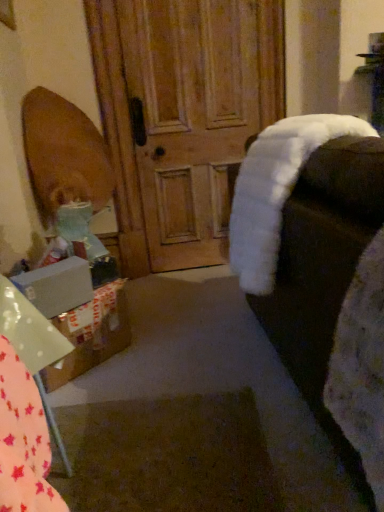
You are a GUI agent. You are given a task and a screenshot of the screen. Output one action in this format:
    pyautogui.click(x=<x>, y=<y>)
    Task: Click on the white fluffy rocking chair at right
    Image resolution: width=384 pixels, height=512 pixels.
    Given the screenshot: What is the action you would take?
    pyautogui.click(x=307, y=242)

Where is `white cardboard box at lower left`? white cardboard box at lower left is located at coordinates (92, 334).

This screenshot has height=512, width=384. Describe the element at coordinates (92, 334) in the screenshot. I see `white cardboard box at lower left` at that location.

This screenshot has height=512, width=384. In order to click on white fluffy rocking chair at right in this screenshot , I will do `click(307, 242)`.

From the image's perspective, is white fluffy rocking chair at right above or below white matte box at lower left?

From the image's perspective, white fluffy rocking chair at right appears above white matte box at lower left.

Is white fluffy rocking chair at right outside of white matte box at lower left?

Indeed, white fluffy rocking chair at right is completely outside white matte box at lower left.

In terms of width, does white fluffy rocking chair at right look wider or thinner when compared to white matte box at lower left?

Clearly, white fluffy rocking chair at right has more width compared to white matte box at lower left.

Considering the positions of objects white fluffy rocking chair at right and white matte box at lower left in the image provided, who is more to the left, white fluffy rocking chair at right or white matte box at lower left?

Positioned to the left is white matte box at lower left.

Who is bigger, white fluffy rocking chair at right or wooden door at center?

white fluffy rocking chair at right.

Considering the relative positions of white fluffy rocking chair at right and wooden door at center in the image provided, is white fluffy rocking chair at right behind wooden door at center?

No, white fluffy rocking chair at right is in front of wooden door at center.

Who is shorter, white fluffy rocking chair at right or wooden door at center?

white fluffy rocking chair at right.

Considering the relative positions of white fluffy rocking chair at right and wooden door at center in the image provided, is white fluffy rocking chair at right to the left of wooden door at center from the viewer's perspective?

No, white fluffy rocking chair at right is not to the left of wooden door at center.

Is white cardboard box at lower left surrounding wooden door at center?

No.

In the image, is white cardboard box at lower left positioned in front of or behind wooden door at center?

white cardboard box at lower left is positioned closer to the viewer than wooden door at center.

Consider the image. From a real-world perspective, is white cardboard box at lower left above or below wooden door at center?

Clearly, from a real-world perspective, white cardboard box at lower left is below wooden door at center.

Is wooden door at center at the back of white cardboard box at lower left?

That's not correct — white cardboard box at lower left is not looking away from wooden door at center.

Where is `rocking chair on the right of cardboard box at lower left`? The image size is (384, 512). rocking chair on the right of cardboard box at lower left is located at coordinates (307, 242).

Considering the positions of point (11, 295) and point (374, 196), is point (11, 295) closer or farther from the camera than point (374, 196)?

Point (11, 295) appears to be farther away from the viewer than point (374, 196).

Measure the distance from cardboard box at lower left to white fluffy rocking chair at right.

They are 30.31 inches apart.

Could you tell me if cardboard box at lower left is facing white fluffy rocking chair at right?

No, cardboard box at lower left is not aimed at white fluffy rocking chair at right.

Which is more distant, (x=150, y=246) or (x=38, y=282)?

The point (x=150, y=246) is farther.

Does wooden door at center have a greater width compared to white matte box at lower left?

Indeed, wooden door at center has a greater width compared to white matte box at lower left.

From a real-world perspective, is wooden door at center positioned above or below white matte box at lower left?

From a real-world perspective, wooden door at center is physically above white matte box at lower left.

Does wooden door at center come behind white matte box at lower left?

Yes, the depth of wooden door at center is greater than that of white matte box at lower left.

Considering the sizes of objects cardboard box at lower left and white cardboard box at lower left in the image provided, who is taller, cardboard box at lower left or white cardboard box at lower left?

cardboard box at lower left.

Which point is more distant from viewer, (22, 339) or (94, 310)?

The point (94, 310) is farther.

From a real-world perspective, is cardboard box at lower left positioned above or below white cardboard box at lower left?

cardboard box at lower left is situated higher than white cardboard box at lower left in the real world.

How different are the orientations of cardboard box at lower left and white cardboard box at lower left in degrees?

46.7 degrees separate the facing orientations of cardboard box at lower left and white cardboard box at lower left.

From the image's perspective, is wooden door at center located above cardboard box at lower left?

Yes, from the image's perspective, wooden door at center is above cardboard box at lower left.

From a real-world perspective, is wooden door at center under cardboard box at lower left?

Actually, wooden door at center is physically above cardboard box at lower left in the real world.

Considering the points (190, 46) and (27, 336), which point is behind, point (190, 46) or point (27, 336)?

Point (190, 46)

Which of these two, wooden door at center or cardboard box at lower left, is bigger?

wooden door at center.

Locate an element on the screen. This screenshot has width=384, height=512. box on the left of white fluffy rocking chair at right is located at coordinates (57, 286).

Locate an element on the screen. This screenshot has height=512, width=384. rocking chair directly beneath the wooden door at center (from a real-world perspective) is located at coordinates (307, 242).

When comparing their distances from white matte box at lower left, does white cardboard box at lower left or cardboard box at lower left seem closer?

Based on the image, white cardboard box at lower left appears to be nearer to white matte box at lower left.

From the image, which object appears to be farther from white cardboard box at lower left, white fluffy rocking chair at right or wooden door at center?

wooden door at center is further to white cardboard box at lower left.

Looking at the image, which one is located closer to white cardboard box at lower left, white matte box at lower left or wooden door at center?

Based on the image, white matte box at lower left appears to be nearer to white cardboard box at lower left.

When comparing their distances from wooden door at center, does white cardboard box at lower left or white matte box at lower left seem closer?

Among the two, white cardboard box at lower left is located nearer to wooden door at center.

From the image, which object appears to be nearer to white matte box at lower left, cardboard box at lower left or white cardboard box at lower left?

white cardboard box at lower left lies closer to white matte box at lower left than the other object.

Based on their spatial positions, is white matte box at lower left or cardboard box at lower left further from wooden door at center?

cardboard box at lower left lies further to wooden door at center than the other object.

Estimate the real-world distances between objects in this image. Which object is closer to cardboard box at lower left, wooden door at center or white fluffy rocking chair at right?

white fluffy rocking chair at right.

Consider the image. Looking at the image, which one is located further to white cardboard box at lower left, cardboard box at lower left or white matte box at lower left?

cardboard box at lower left lies further to white cardboard box at lower left than the other object.

You are a GUI agent. You are given a task and a screenshot of the screen. Output one action in this format:
    pyautogui.click(x=<x>, y=<y>)
    Task: Click on the rocking chair between cardboard box at lower left and white matte box at lower left from front to back
    This screenshot has width=384, height=512.
    Given the screenshot: What is the action you would take?
    pyautogui.click(x=307, y=242)

Where is `box located between cardboard box at lower left and wooden door at center in the depth direction`? This screenshot has width=384, height=512. box located between cardboard box at lower left and wooden door at center in the depth direction is located at coordinates (57, 286).

Find the location of a particular element. This screenshot has width=384, height=512. cardboard box between white fluffy rocking chair at right and wooden door at center from front to back is located at coordinates (92, 334).

Locate an element on the screen. This screenshot has width=384, height=512. box between white fluffy rocking chair at right and wooden door at center along the z-axis is located at coordinates (57, 286).